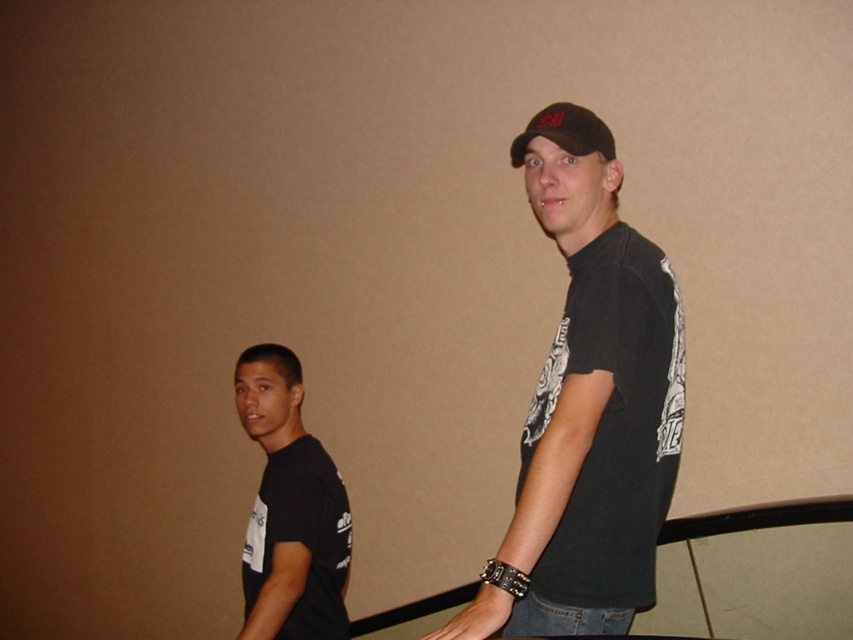
Is point (553, 556) farther from camera compared to point (285, 492)?

No, (553, 556) is in front of (285, 492).

Is point (601, 534) positioned behind point (303, 518)?

No, (601, 534) is in front of (303, 518).

Find the location of a particular element. This screenshot has height=640, width=853. black matte t-shirt at center is located at coordinates (589, 406).